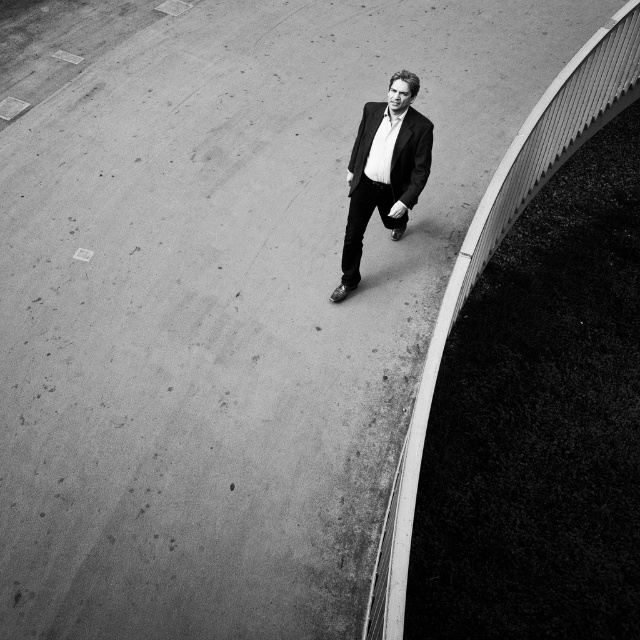
Does smooth concrete curb at right appear on the left side of matte black suit at center?

Correct, you'll find smooth concrete curb at right to the left of matte black suit at center.

The width and height of the screenshot is (640, 640). I want to click on smooth concrete curb at right, so click(x=490, y=257).